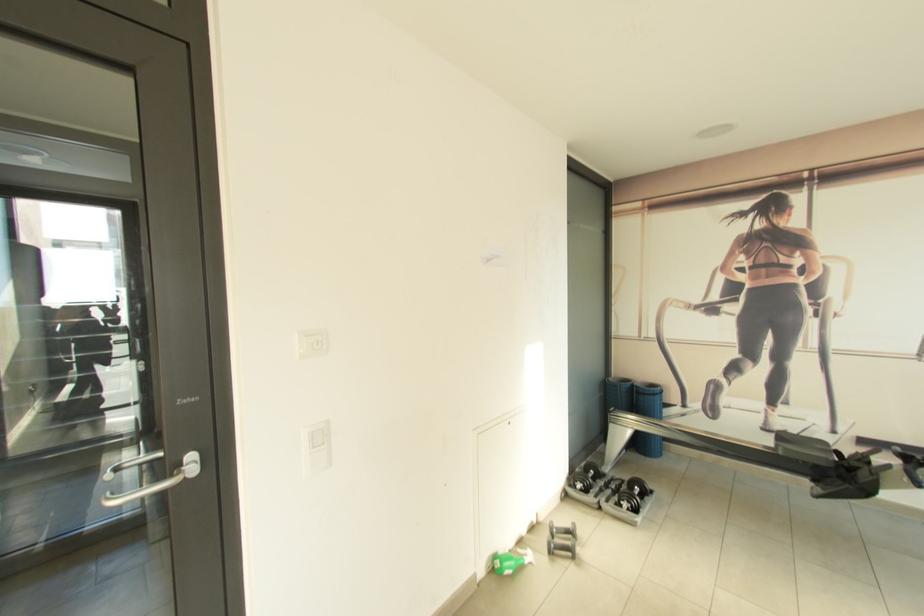
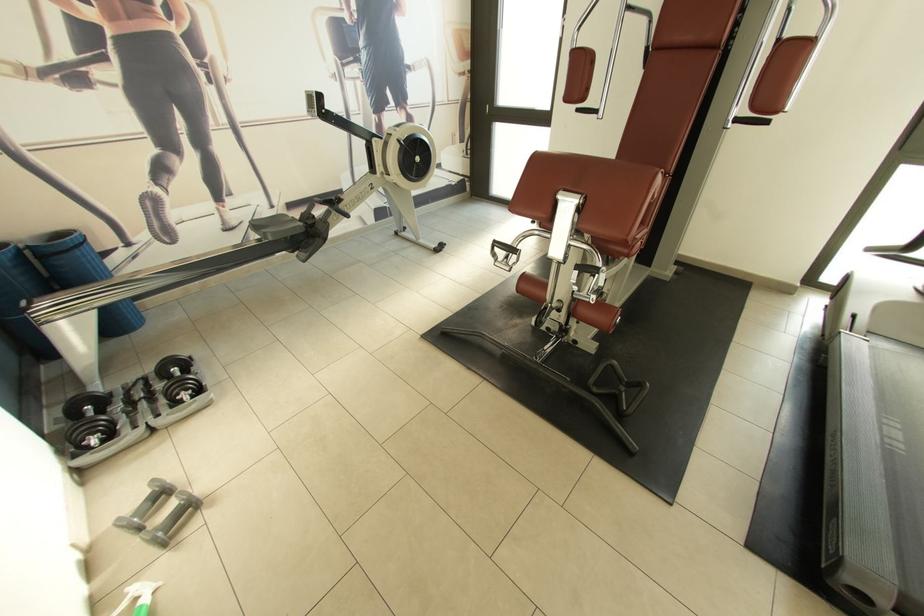
The point at (640, 512) is marked in the first image. Where is the corresponding point in the second image?

(204, 392)